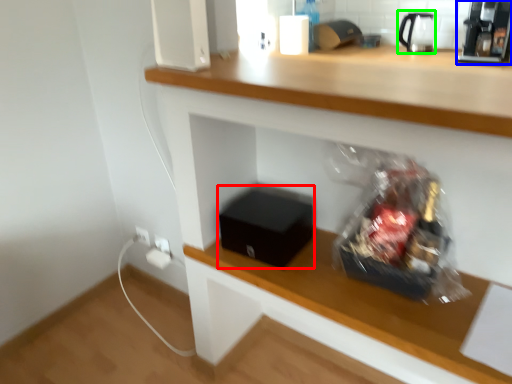
Question: Which object is positioned farthest from box (highlighted by a red box)? Select from coffee machine (highlighted by a blue box) and tea pot (highlighted by a green box).

Choices:
 (A) coffee machine
 (B) tea pot

Answer: (B)